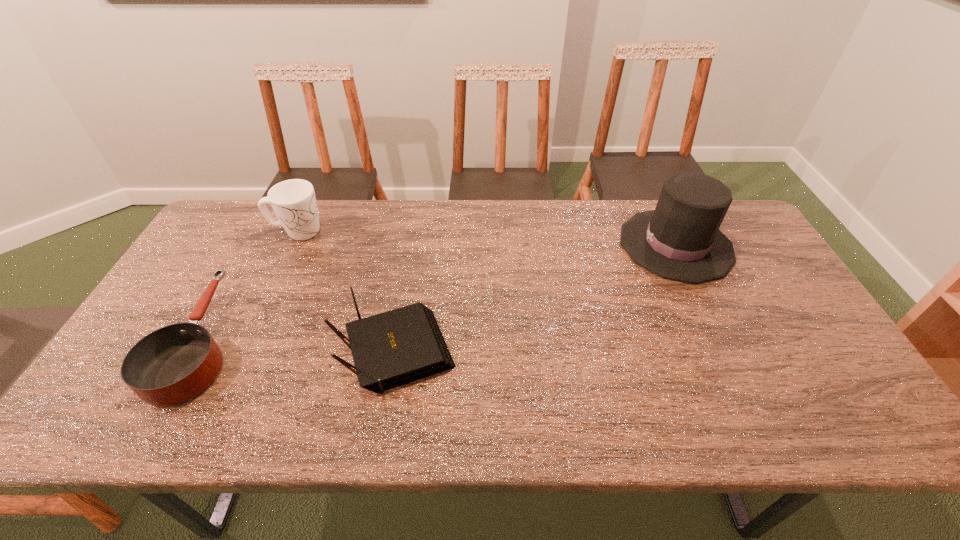
Locate an element on the screen. The height and width of the screenshot is (540, 960). vacant space in between the third tallest object and the dress hat is located at coordinates (536, 300).

Locate an element on the screen. Image resolution: width=960 pixels, height=540 pixels. free space between the second tallest object and the shortest object is located at coordinates (250, 286).

Image resolution: width=960 pixels, height=540 pixels. I want to click on vacant region between the second object from right to left and the shortest object, so click(299, 347).

The image size is (960, 540). Find the location of `vacant space that's between the rightmost object and the pan`. vacant space that's between the rightmost object and the pan is located at coordinates (x=439, y=293).

The image size is (960, 540). In order to click on free area in between the pan and the second tallest object in this screenshot , I will do `click(250, 286)`.

Locate an element on the screen. This screenshot has width=960, height=540. empty space that is in between the third object from left to right and the tallest object is located at coordinates (536, 300).

Locate which object is the closest to the mug. Please provide its 2D coordinates. Your answer should be formatted as a tuple, i.e. [(x, y)], where the tuple contains the x and y coordinates of a point satisfying the conditions above.

[(171, 365)]

The height and width of the screenshot is (540, 960). Find the location of `the third closest object to the second tallest object`. the third closest object to the second tallest object is located at coordinates (680, 240).

Image resolution: width=960 pixels, height=540 pixels. I want to click on vacant point that satisfies the following two spatial constraints: 1. on the front of the tallest object with the decoration; 2. on the front side of the second object from right to left, so click(728, 355).

Find the location of a particular element. free region that satisfies the following two spatial constraints: 1. on the side of the router with the handle; 2. on the left side of the mug is located at coordinates (240, 355).